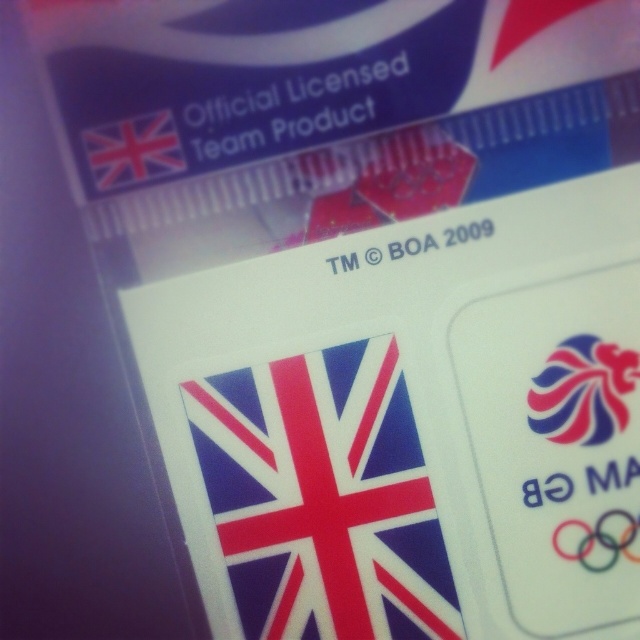
You are designing a layout for a product label and need to place the blue glossy logo at upper right and the matte plastic flag at upper left. Based on the provided image, which object should be placed to the left side of the other?

The matte plastic flag at upper left should be placed to the left of the blue glossy logo at upper right because the blue glossy logo at upper right is positioned to the right of matte plastic flag at upper left in the original image.